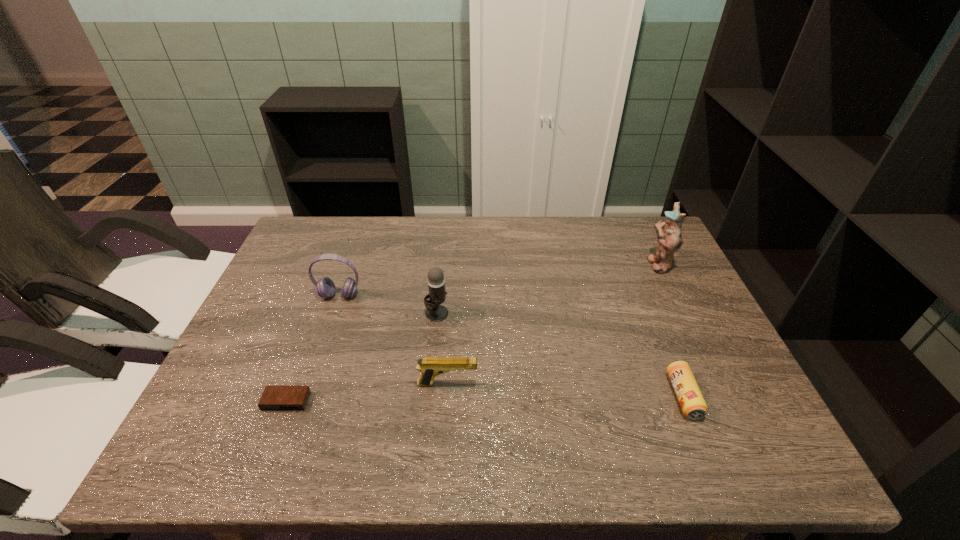
Where is `blank space located on the front-facing side of the farthest object`? blank space located on the front-facing side of the farthest object is located at coordinates (604, 264).

Locate an element on the screen. free space located 0.380m on the back of the microphone is located at coordinates (445, 225).

Locate an element on the screen. This screenshot has width=960, height=540. vacant area situated on the headband and ear cups of the headset is located at coordinates (314, 369).

The image size is (960, 540). In order to click on blank area located at the barrel of the third shortest object in this screenshot , I will do `click(514, 384)`.

Where is `free location located 0.070m on the back of the second shortest object`? free location located 0.070m on the back of the second shortest object is located at coordinates (664, 349).

Locate an element on the screen. The height and width of the screenshot is (540, 960). vacant area located on the front face of the shortest object is located at coordinates (264, 461).

Image resolution: width=960 pixels, height=540 pixels. Find the location of `object positioned at the far edge`. object positioned at the far edge is located at coordinates (668, 232).

Where is `headset situated at the left edge`? This screenshot has height=540, width=960. headset situated at the left edge is located at coordinates (325, 287).

At what (x,y) coordinates should I click in order to perform the action: click on alarm clock located in the left edge section of the desktop. Please return your answer as a coordinate pair (x, y). The image size is (960, 540). Looking at the image, I should click on (274, 398).

Locate an element on the screen. This screenshot has height=540, width=960. figurine situated at the right edge is located at coordinates (668, 232).